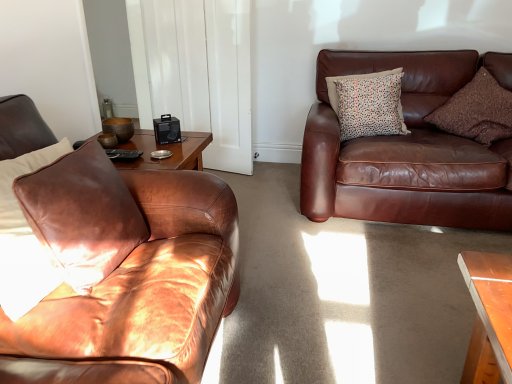
Question: Can you confirm if brown leather couch at right, the second studio couch viewed from the front, is smaller than white glossy door at upper center?

Choices:
 (A) yes
 (B) no

Answer: (B)

Question: Does brown leather couch at right, which is counted as the first studio couch, starting from the back, have a lesser width compared to white glossy door at upper center?

Choices:
 (A) no
 (B) yes

Answer: (A)

Question: Is brown leather couch at right, the first studio couch from the right, surrounding white glossy door at upper center?

Choices:
 (A) no
 (B) yes

Answer: (A)

Question: Is brown leather couch at right, the second studio couch viewed from the front, facing towards white glossy door at upper center?

Choices:
 (A) yes
 (B) no

Answer: (B)

Question: Is brown leather couch at right, the second studio couch viewed from the front, to the right of white glossy door at upper center from the viewer's perspective?

Choices:
 (A) yes
 (B) no

Answer: (A)

Question: In terms of size, does multicolored dotted cushion at upper right, which is the second pillow from right to left, appear bigger or smaller than matte brown leather couch at left, positioned as the 1th studio couch in left-to-right order?

Choices:
 (A) small
 (B) big

Answer: (A)

Question: Considering the positions of multicolored dotted cushion at upper right, which is the second pillow from right to left, and matte brown leather couch at left, marked as the 2th studio couch in a back-to-front arrangement, in the image, is multicolored dotted cushion at upper right, which is the second pillow from right to left, taller or shorter than matte brown leather couch at left, marked as the 2th studio couch in a back-to-front arrangement,?

Choices:
 (A) tall
 (B) short

Answer: (B)

Question: Is point (334, 91) positioned closer to the camera than point (44, 241)?

Choices:
 (A) closer
 (B) farther

Answer: (B)

Question: From a real-world perspective, relative to matte brown leather couch at left, positioned as the 1th studio couch in left-to-right order, is multicolored dotted cushion at upper right, which is the second pillow from right to left, vertically above or below?

Choices:
 (A) below
 (B) above

Answer: (B)

Question: From the image's perspective, relative to brown leather pillow at left, the first pillow from the front, is multicolored dotted cushion at upper right, positioned as the first pillow in back-to-front order, above or below?

Choices:
 (A) below
 (B) above

Answer: (B)

Question: Considering the positions of point (364, 87) and point (72, 168), is point (364, 87) closer or farther from the camera than point (72, 168)?

Choices:
 (A) farther
 (B) closer

Answer: (A)

Question: Looking at their shapes, would you say multicolored dotted cushion at upper right, the second pillow from the left, is wider or thinner than brown leather pillow at left, which is the 3th pillow from back to front?

Choices:
 (A) wide
 (B) thin

Answer: (B)

Question: In the image, is multicolored dotted cushion at upper right, the 3th pillow viewed from the front, positioned in front of or behind brown leather pillow at left, marked as the third pillow in a right-to-left arrangement?

Choices:
 (A) behind
 (B) front

Answer: (A)

Question: Considering the positions of brown leather couch at right, the second studio couch viewed from the front, and brown textured pillow at upper right, the first pillow in the right-to-left sequence, in the image, is brown leather couch at right, the second studio couch viewed from the front, taller or shorter than brown textured pillow at upper right, the first pillow in the right-to-left sequence,?

Choices:
 (A) tall
 (B) short

Answer: (A)

Question: Is brown leather couch at right, the first studio couch from the right, to the left or to the right of brown textured pillow at upper right, which is the 3th pillow in left-to-right order, in the image?

Choices:
 (A) left
 (B) right

Answer: (A)